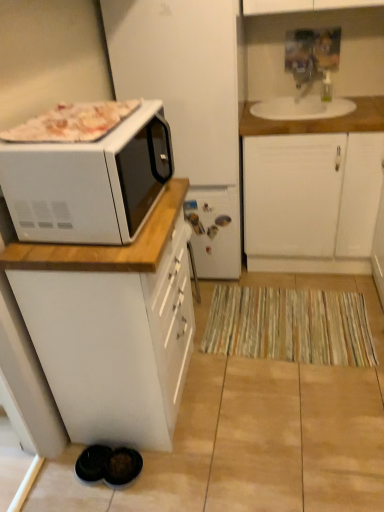
Question: Can you confirm if white glossy microwave at upper left is shorter than wooden countertop at upper right?

Choices:
 (A) no
 (B) yes

Answer: (A)

Question: Is white glossy microwave at upper left next to wooden countertop at upper right?

Choices:
 (A) no
 (B) yes

Answer: (A)

Question: Is white glossy microwave at upper left closer to camera compared to wooden countertop at upper right?

Choices:
 (A) no
 (B) yes

Answer: (B)

Question: Could you tell me if white glossy microwave at upper left is facing wooden countertop at upper right?

Choices:
 (A) no
 (B) yes

Answer: (A)

Question: Considering the relative positions of white glossy microwave at upper left and wooden countertop at upper right in the image provided, is white glossy microwave at upper left to the right of wooden countertop at upper right from the viewer's perspective?

Choices:
 (A) no
 (B) yes

Answer: (A)

Question: In terms of width, does white matte cabinet at left, acting as the 1th cabinetry starting from the front, look wider or thinner when compared to wooden countertop at upper right?

Choices:
 (A) thin
 (B) wide

Answer: (B)

Question: Considering the positions of white matte cabinet at left, acting as the 1th cabinetry starting from the front, and wooden countertop at upper right in the image, is white matte cabinet at left, acting as the 1th cabinetry starting from the front, bigger or smaller than wooden countertop at upper right?

Choices:
 (A) small
 (B) big

Answer: (B)

Question: From the image's perspective, is white matte cabinet at left, acting as the 1th cabinetry starting from the front, located above or below wooden countertop at upper right?

Choices:
 (A) above
 (B) below

Answer: (B)

Question: Choose the correct answer: Is white matte cabinet at left, acting as the 1th cabinetry starting from the front, inside wooden countertop at upper right or outside it?

Choices:
 (A) inside
 (B) outside

Answer: (B)

Question: In the image, is striped fabric mat at lower center positioned in front of or behind white glossy microwave at upper left?

Choices:
 (A) front
 (B) behind

Answer: (B)

Question: Would you say striped fabric mat at lower center is to the left or to the right of white glossy microwave at upper left in the picture?

Choices:
 (A) left
 (B) right

Answer: (B)

Question: Based on their sizes in the image, would you say striped fabric mat at lower center is bigger or smaller than white glossy microwave at upper left?

Choices:
 (A) big
 (B) small

Answer: (B)

Question: Is striped fabric mat at lower center inside or outside of white glossy microwave at upper left?

Choices:
 (A) outside
 (B) inside

Answer: (A)

Question: Is wooden countertop at upper right inside the boundaries of white glossy microwave at upper left, or outside?

Choices:
 (A) inside
 (B) outside

Answer: (B)

Question: Considering the positions of wooden countertop at upper right and white glossy microwave at upper left in the image, is wooden countertop at upper right bigger or smaller than white glossy microwave at upper left?

Choices:
 (A) small
 (B) big

Answer: (A)